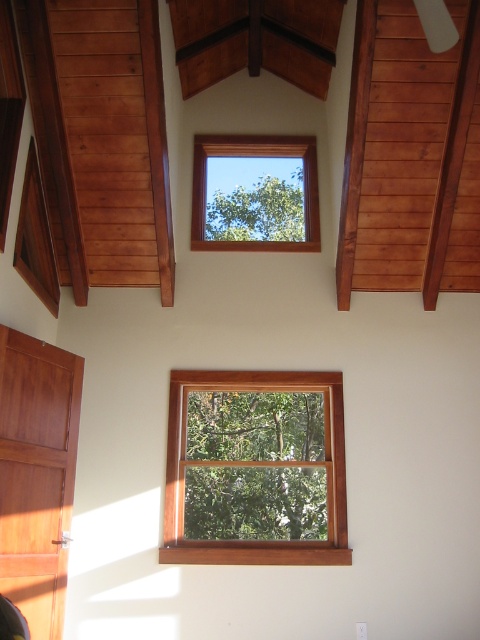
You are an interior designer planning to install a new decorative item. You have two options to choose from. The first option is a large wooden frame that matches the existing wooden frame at center. The second option is a smaller glass window similar to the clear glass window at upper center. Based on the size of the existing items, which option would you recommend for a more harmonious design?

The wooden frame at center is bigger than the clear glass window at upper center. Therefore, choosing the large wooden frame would maintain a harmonious design as it aligns with the scale of the existing larger wooden frame.

You are an interior designer planning to hang a large painting that requires a minimum of 1.2 meters in height. You see the wooden frame at center and the clear glass window at upper center. Which object can accommodate the painting based on their height?

The wooden frame at center is taller than the clear glass window at upper center, so the wooden frame at center can accommodate the painting as it meets the required height of 1.2 meters.

In the scene shown: You are an interior designer planning to install a new decorative element. You have a choice between placing it on the wooden frame at center or the clear glass window at upper center. Which location has a wider surface area to accommodate larger decorations?

The wooden frame at center has a wider surface area than the clear glass window at upper center because its width surpasses the window.